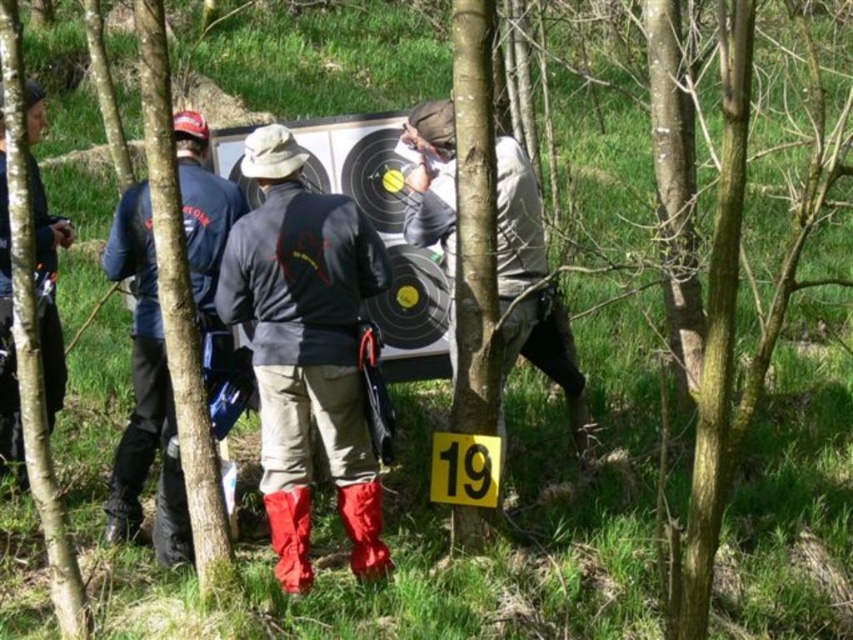
You are an observer standing in the middle of the grassy area. You see the dark gray leather jacket at center and the brushed metal jacket at left. Which jacket is shorter in height?

The dark gray leather jacket at center has a lesser height compared to the brushed metal jacket at left, so the dark gray leather jacket at center is shorter.

Looking at this image, you are a participant in the shooting activity and see the dark gray leather jacket at center and the brushed metal jacket at left. Which jacket is closer to the target board mounted on a stand?

The dark gray leather jacket at center is positioned on the right side of the brushed metal jacket at left, so the brushed metal jacket at left is closer to the target board mounted on a stand.